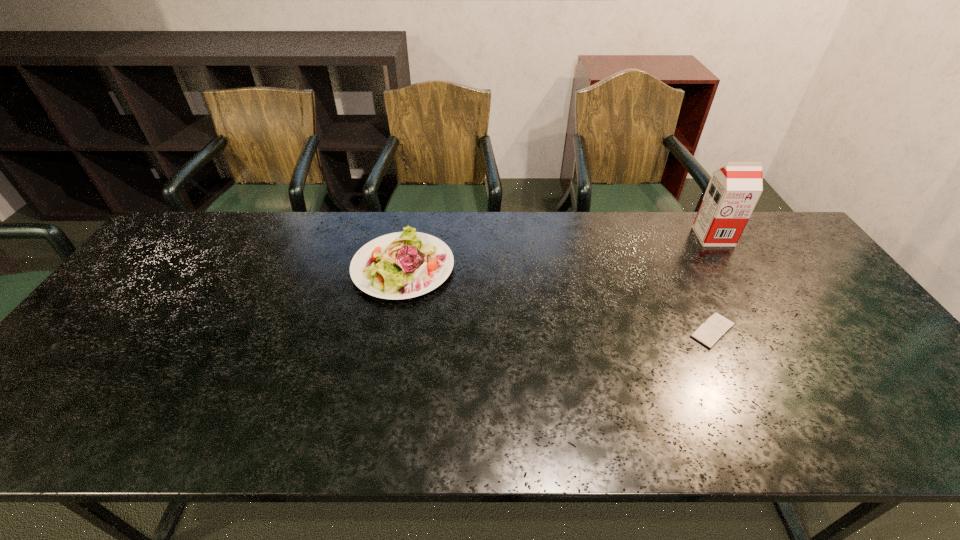
I want to click on salad plate that is at the far edge, so click(x=401, y=265).

Image resolution: width=960 pixels, height=540 pixels. Identify the location of vacant position at the far edge of the desktop. (745, 250).

The height and width of the screenshot is (540, 960). What are the coordinates of `vacant space at the near edge of the desktop` in the screenshot? It's located at (416, 422).

Image resolution: width=960 pixels, height=540 pixels. Find the location of `vacant space at the left edge`. vacant space at the left edge is located at coordinates (100, 370).

Find the location of a particular element. free space at the right edge of the desktop is located at coordinates (840, 295).

Find the location of a particular element. The width and height of the screenshot is (960, 540). vacant region at the far left corner of the desktop is located at coordinates coord(208,237).

Where is `vacant space that's between the leftmost object and the rightmost object`? This screenshot has width=960, height=540. vacant space that's between the leftmost object and the rightmost object is located at coordinates (558, 252).

Identify the location of free space between the tallest object and the nearest object. Image resolution: width=960 pixels, height=540 pixels. (713, 284).

Where is `free spot between the second object from right to left and the soya milk`? The height and width of the screenshot is (540, 960). free spot between the second object from right to left and the soya milk is located at coordinates (713, 284).

Where is `empty location between the leftmost object and the tallest object`? empty location between the leftmost object and the tallest object is located at coordinates (558, 252).